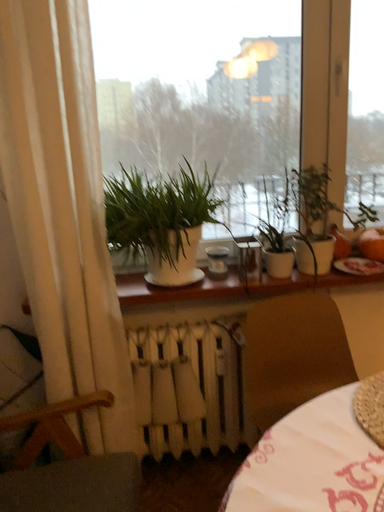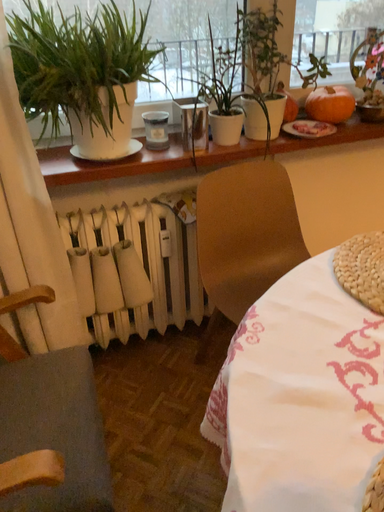
Question: Which way did the camera rotate in the video?

Choices:
 (A) rotated downward
 (B) rotated upward

Answer: (A)